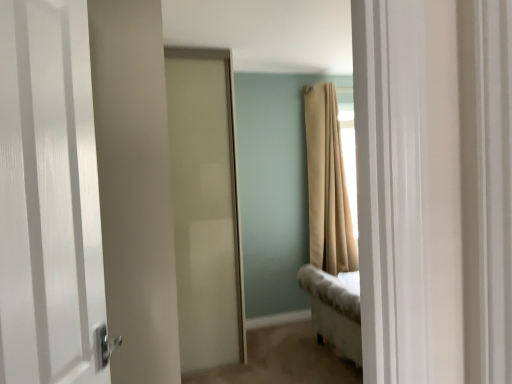
Question: Is point [x=60, y=372] positioned closer to the camera than point [x=324, y=119]?

Choices:
 (A) farther
 (B) closer

Answer: (B)

Question: Is white glossy door at left, positioned as the first door in front-to-back order, to the left or to the right of beige fabric curtain at upper right in the image?

Choices:
 (A) left
 (B) right

Answer: (A)

Question: Considering the real-world distances, which object is closest to the beige fabric curtain at upper right?

Choices:
 (A) satin white door at center, the 1th door from the back
 (B) white glossy door at left, positioned as the first door in front-to-back order

Answer: (A)

Question: Which of these objects is positioned farthest from the white glossy door at left, positioned as the first door in front-to-back order?

Choices:
 (A) beige fabric curtain at upper right
 (B) satin white door at center, placed as the 2th door when sorted from front to back

Answer: (A)